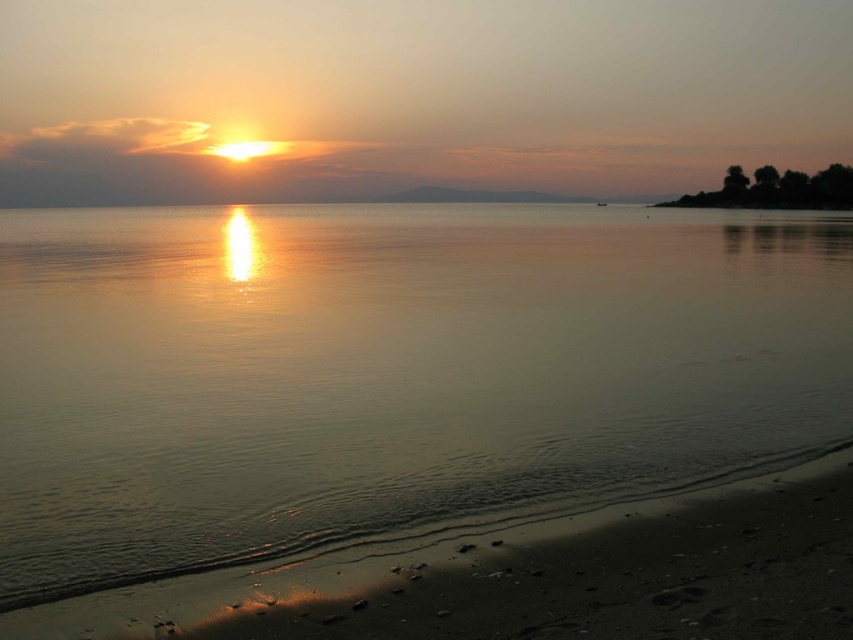
You are standing on the sandy beach at lower right and want to walk to the smooth water at center. Which direction should you move to reach it?

The smooth water at center is located above the sandy beach at lower right, so you should move upward to reach it.

You are a photographer planning to capture the sunset reflection on the water. You have a camera with a 30cm wide lens. The smooth water at center and sandy beach at lower right are in your view. Can both fit in your camera frame if the frame is 30cm wide?

The smooth water at center is bigger than sandy beach at lower right. Since the frame is 30cm wide, both objects can fit as long as their combined width doesn